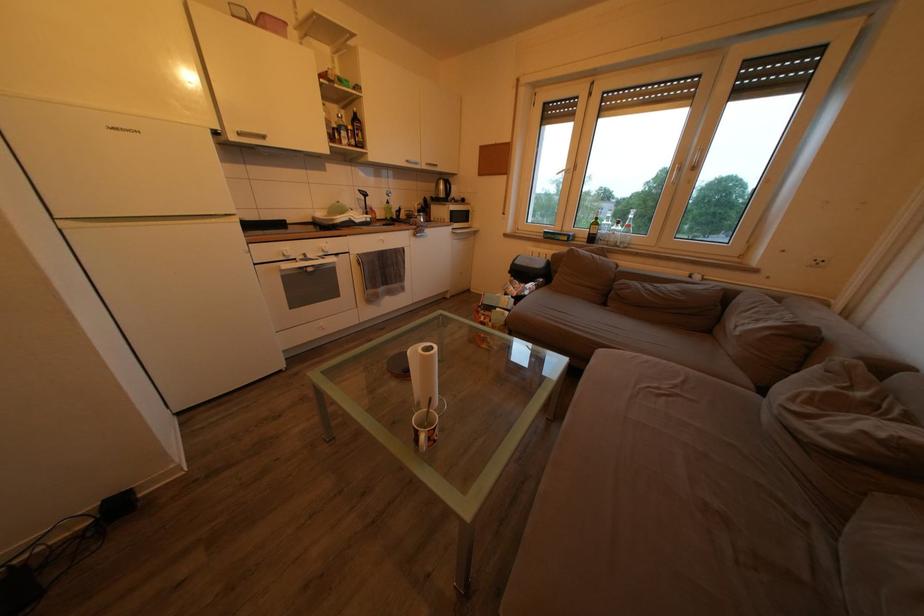
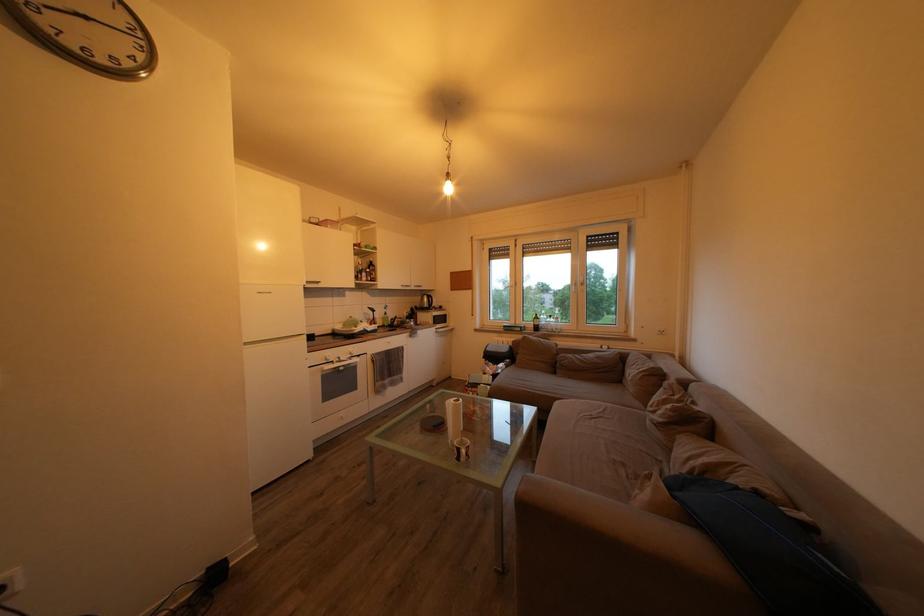
Where in the second image is the point corresponding to (x=599, y=100) from the first image?

(524, 252)